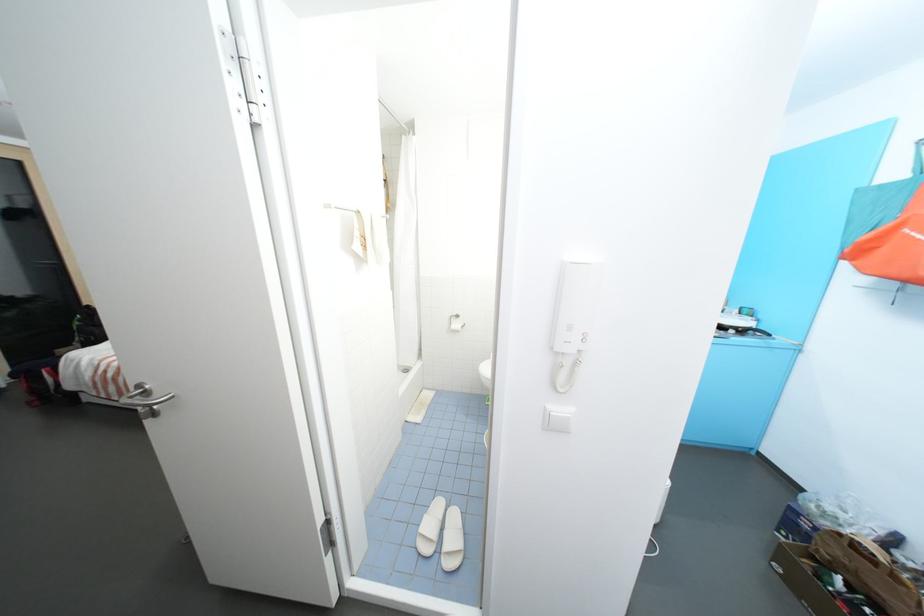
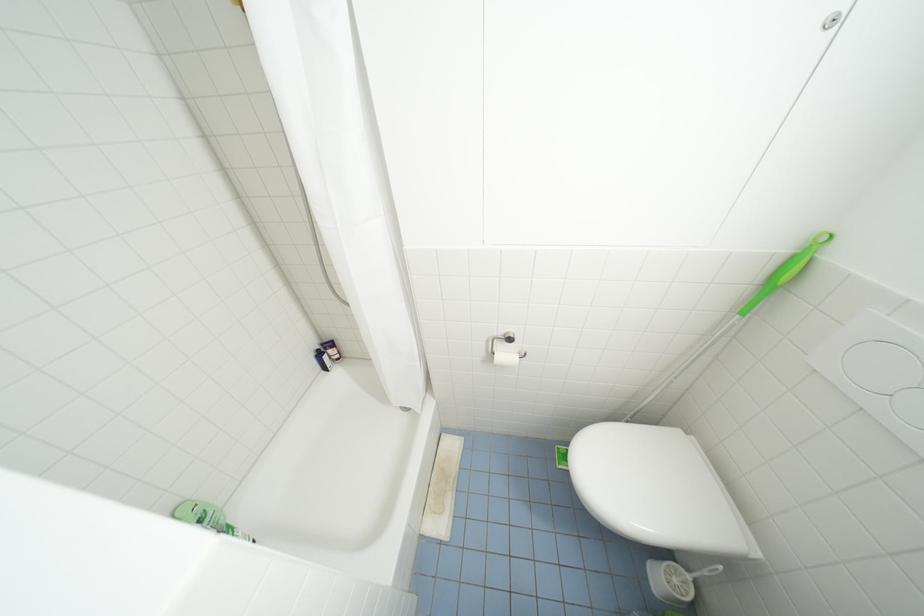
Question: What movement of the cameraman would produce the second image?

Choices:
 (A) Left
 (B) Right
 (C) Forward
 (D) Backward

Answer: (C)